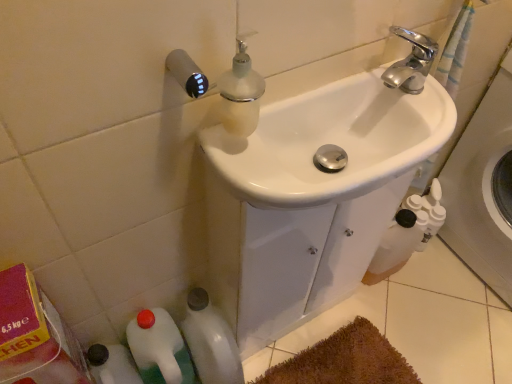
Question: From the image's perspective, does white glossy bottle at lower left, the first bottle when ordered from right to left, appear lower than white plastic bottle at lower left, the second bottle when ordered from right to left?

Choices:
 (A) yes
 (B) no

Answer: (B)

Question: From the image's perspective, does white glossy bottle at lower left, the first bottle when ordered from right to left, appear higher than white plastic bottle at lower left, which ranks as the 1th bottle in left-to-right order?

Choices:
 (A) no
 (B) yes

Answer: (B)

Question: Is white glossy bottle at lower left, the first bottle when ordered from right to left, taller than white plastic bottle at lower left, which ranks as the 1th bottle in left-to-right order?

Choices:
 (A) yes
 (B) no

Answer: (B)

Question: Does white glossy bottle at lower left, the first bottle when ordered from right to left, have a lesser height compared to white plastic bottle at lower left, the second bottle when ordered from right to left?

Choices:
 (A) yes
 (B) no

Answer: (A)

Question: Considering the relative positions of white glossy bottle at lower left, the second bottle when ordered from left to right, and white plastic bottle at lower left, which ranks as the 1th bottle in left-to-right order, in the image provided, is white glossy bottle at lower left, the second bottle when ordered from left to right, to the left of white plastic bottle at lower left, which ranks as the 1th bottle in left-to-right order, from the viewer's perspective?

Choices:
 (A) no
 (B) yes

Answer: (A)

Question: From a real-world perspective, relative to white plastic bottles at right, is white glossy bottle at lower left, the first bottle when ordered from right to left, vertically above or below?

Choices:
 (A) below
 (B) above

Answer: (A)

Question: Based on their positions, is white glossy bottle at lower left, the second bottle when ordered from left to right, located to the left or right of white plastic bottles at right?

Choices:
 (A) right
 (B) left

Answer: (B)

Question: From the image's perspective, is white glossy bottle at lower left, the first bottle when ordered from right to left, above or below white plastic bottles at right?

Choices:
 (A) above
 (B) below

Answer: (B)

Question: Considering the positions of white glossy bottle at lower left, the second bottle when ordered from left to right, and white plastic bottles at right in the image, is white glossy bottle at lower left, the second bottle when ordered from left to right, bigger or smaller than white plastic bottles at right?

Choices:
 (A) small
 (B) big

Answer: (A)

Question: Looking at their shapes, would you say white glossy sink at center is wider or thinner than white plastic bottle at lower left, which ranks as the 1th bottle in left-to-right order?

Choices:
 (A) wide
 (B) thin

Answer: (A)

Question: In terms of size, does white glossy sink at center appear bigger or smaller than white plastic bottle at lower left, the second bottle when ordered from right to left?

Choices:
 (A) small
 (B) big

Answer: (B)

Question: Do you think white glossy sink at center is within white plastic bottle at lower left, the second bottle when ordered from right to left, or outside of it?

Choices:
 (A) outside
 (B) inside

Answer: (A)

Question: From a real-world perspective, is white glossy sink at center positioned above or below white plastic bottle at lower left, the second bottle when ordered from right to left?

Choices:
 (A) above
 (B) below

Answer: (A)

Question: In the image, is white plastic bottle at lower left, the second bottle when ordered from right to left, positioned in front of or behind white plastic bottles at right?

Choices:
 (A) front
 (B) behind

Answer: (B)

Question: Considering the positions of point (185, 354) and point (499, 256), is point (185, 354) closer or farther from the camera than point (499, 256)?

Choices:
 (A) farther
 (B) closer

Answer: (B)